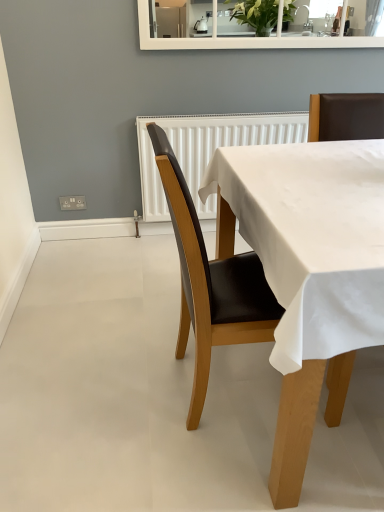
Locate an element on the screen. The image size is (384, 512). free region on the left part of black leather chair at center is located at coordinates (115, 387).